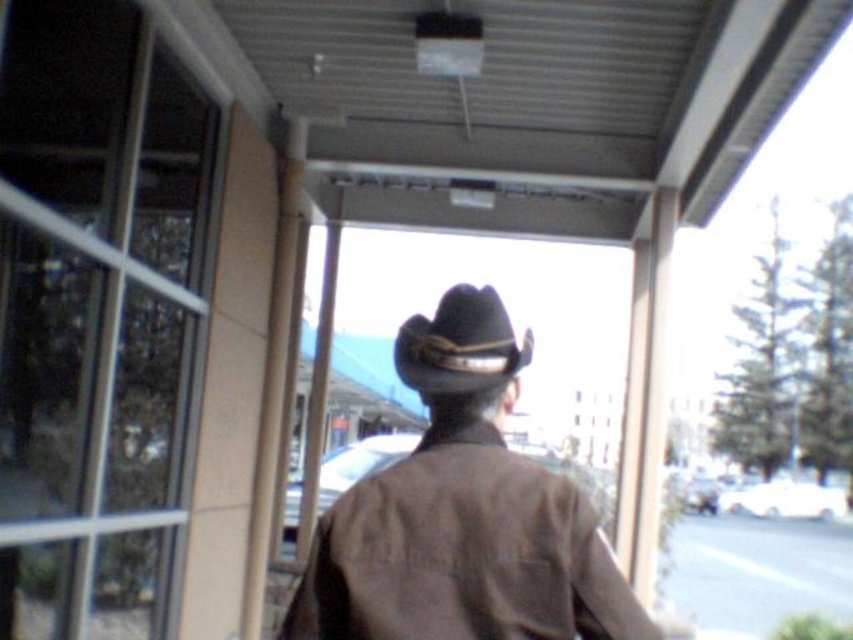
You are a photographer trying to capture the brown leather cowboy hat at center in your shot. The camera is set to focus at point 0.8, 0.5. Will the hat be in focus?

The brown leather cowboy hat at center is located at point (463, 513), which is very close to the camera focus point of (426, 512). Therefore, the hat will be in focus.

You are a photographer trying to capture the brown leather cowboy hat at center in your shot. If your camera has a focal length of 50mm and you want to ensure the hat is centered in the frame, where should you position your camera relative to the hat?

The brown leather cowboy hat at center is located at coordinates point (x=463, y=513). To center it in your 50mm focal length shot, position your camera directly facing the hat along the line perpendicular to the walkway at those coordinates.